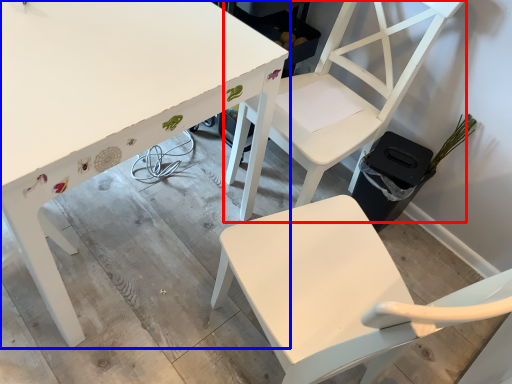
Question: Which of the following is the farthest to the observer, chair (highlighted by a red box) or table (highlighted by a blue box)?

Choices:
 (A) chair
 (B) table

Answer: (A)